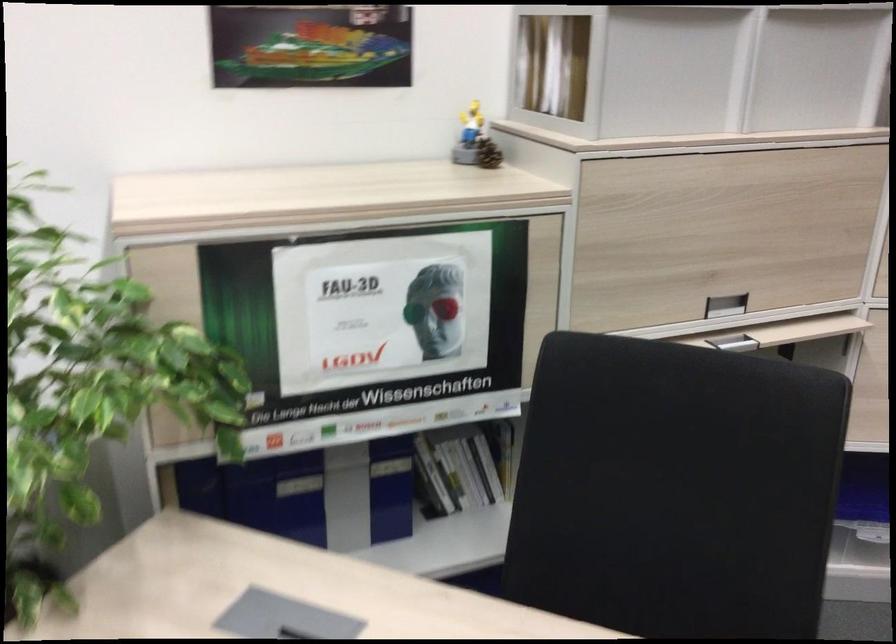
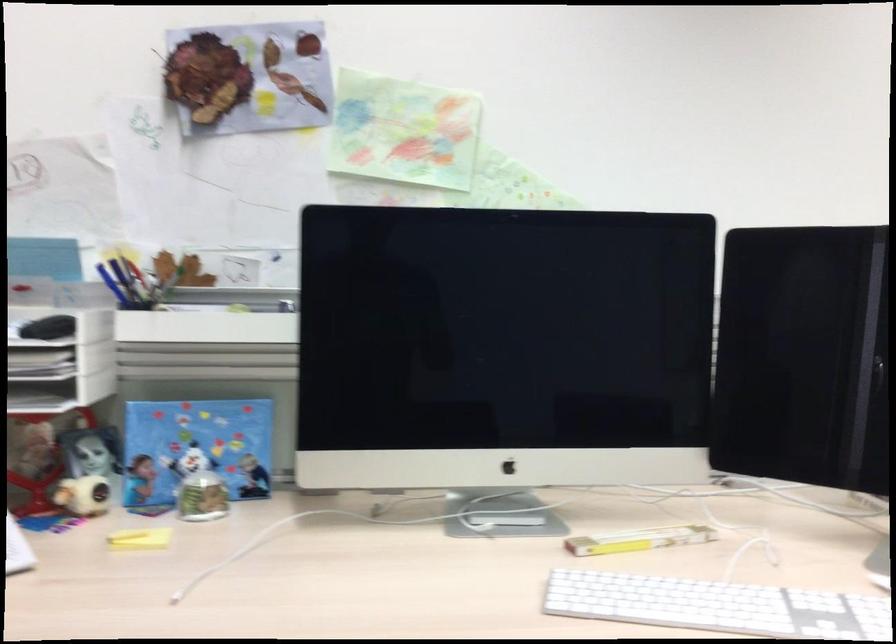
Question: Which direction would the cameraman need to move to produce the second image? Reply with the corresponding letter.

Choices:
 (A) Left
 (B) Right
 (C) Forward
 (D) Backward

Answer: (A)